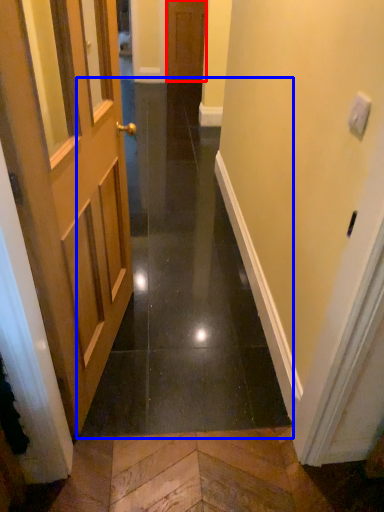
Question: Which of the following is the farthest to the observer, door (highlighted by a red box) or path (highlighted by a blue box)?

Choices:
 (A) door
 (B) path

Answer: (A)